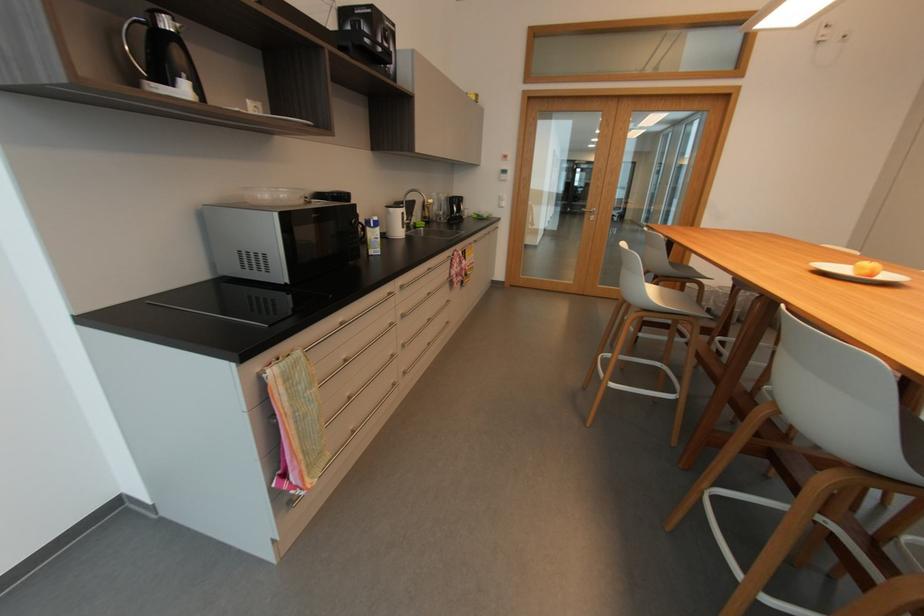
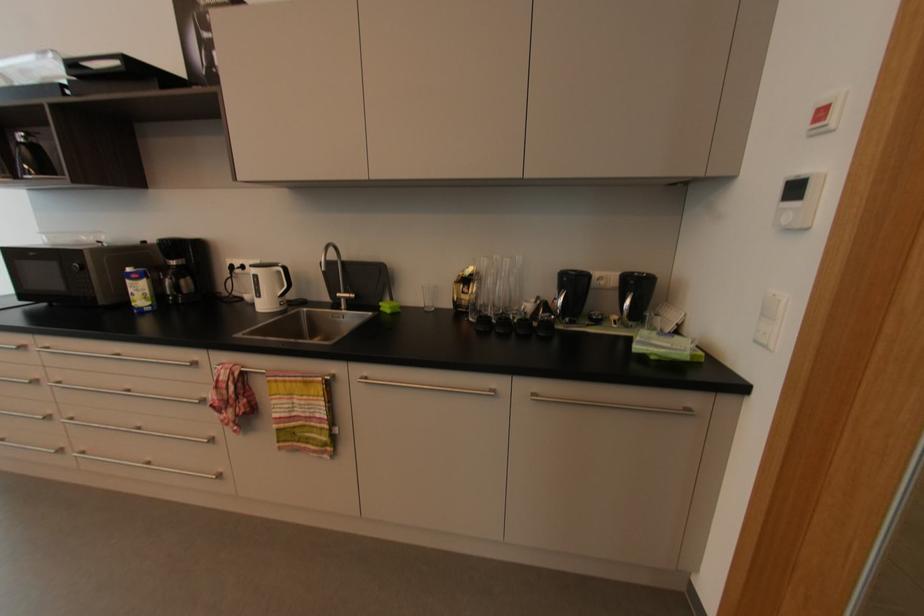
Locate, in the second image, the point that corresponds to point 508,153 in the first image.

(832, 99)